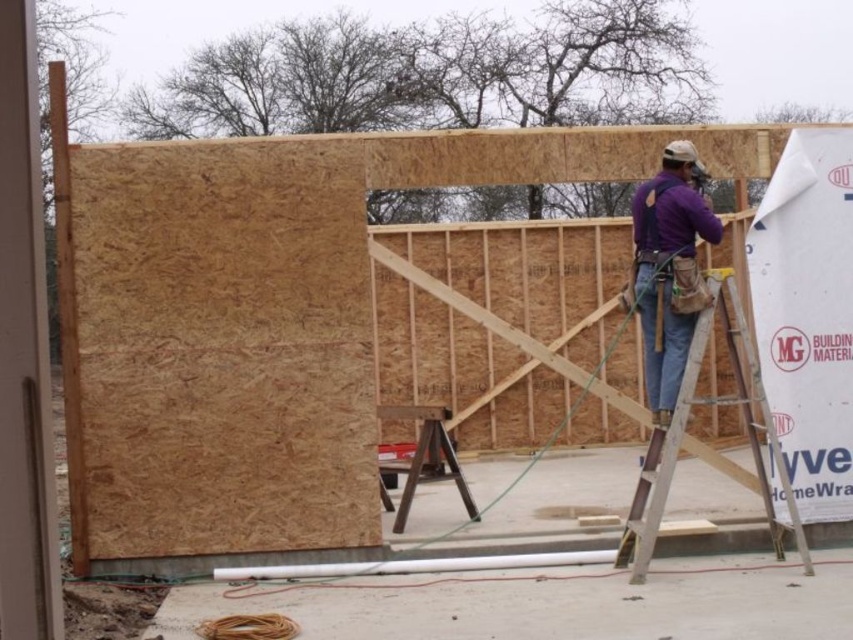
Question: Does purple cotton shirt at center have a larger size compared to silver metallic ladder at center?

Choices:
 (A) yes
 (B) no

Answer: (B)

Question: Can you confirm if purple cotton shirt at center is thinner than silver metallic ladder at center?

Choices:
 (A) yes
 (B) no

Answer: (A)

Question: Does purple cotton shirt at center appear on the right side of silver metallic ladder at center?

Choices:
 (A) no
 (B) yes

Answer: (A)

Question: Which point is closer to the camera?

Choices:
 (A) purple cotton shirt at center
 (B) silver metallic ladder at center

Answer: (B)

Question: Which object is farther from the camera taking this photo?

Choices:
 (A) silver metallic ladder at center
 (B) purple cotton shirt at center

Answer: (B)

Question: Among these objects, which one is farthest from the camera?

Choices:
 (A) purple cotton shirt at center
 (B) silver metallic ladder at center

Answer: (A)